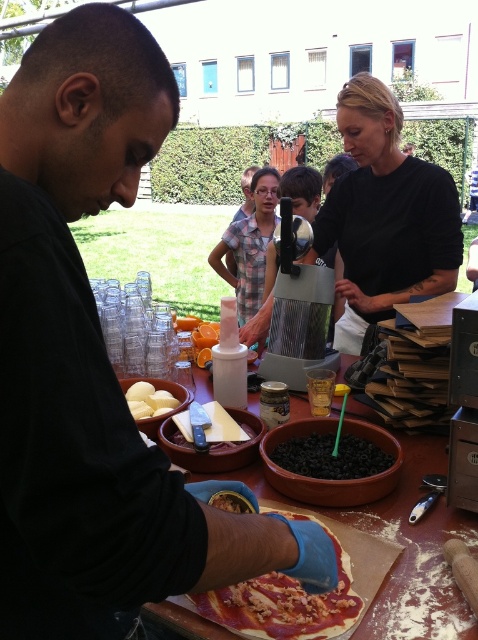
You are a photographer taking a picture of the scene. You notice the black matte shirt at upper center and the white matte potato at center. Which object should you focus on first if you want to capture both in the same frame without moving the camera?

You should focus on the white matte potato at center first because the black matte shirt at upper center is to the right of it, so keeping the potato centered will ensure both are in frame.

You are a photographer standing at the edge of the scene. You need to capture a photo where the black matte shirt at upper center and the white matte potato at center are both visible. Based on their positions, which object will appear larger in the photo?

The black matte shirt at upper center appears larger in the photo because it has a greater height compared to the white matte potato at center.

From the picture: You are a chef preparing ingredients for a pizza. You need to cut the white matte potato at center into small cubes. Where is the sharp metallic knife at center located relative to the potato?

The sharp metallic knife at center is positioned under the white matte potato at center, so it is directly beneath the potato and ready to be used for cutting.